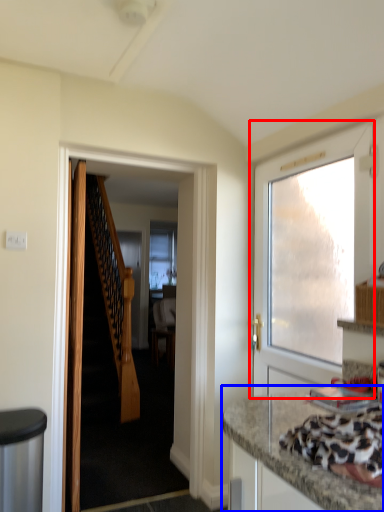
Question: Among these objects, which one is nearest to the camera, door (highlighted by a red box) or countertop (highlighted by a blue box)?

Choices:
 (A) door
 (B) countertop

Answer: (B)